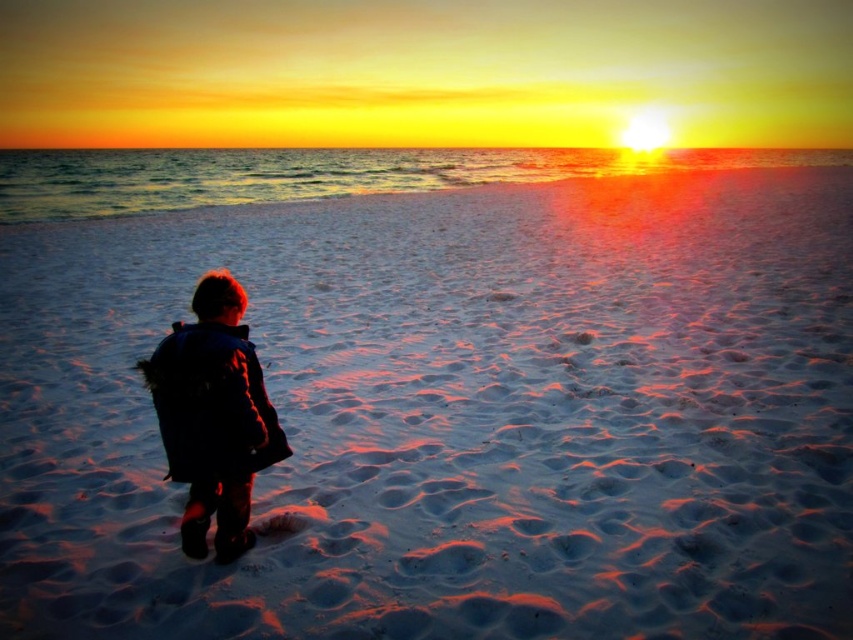
You are a photographer trying to capture the sunset at the beach. You have to decide whether to focus on the white sandy beach at center or the dark blue jacket at lower left. Which object is closer to you, and why?

The dark blue jacket at lower left is closer to you because the white sandy beach at center is further away from the viewer, meaning the jacket is positioned nearer in the scene.

You are standing on the beach and see two points marked on the sand. One is at coordinate point (770,419) and the other at point (268,426). Which point is closer to your current position?

Point (770,419) is further to the viewer than point (268,426), so the point at (268,426) is closer to your current position.